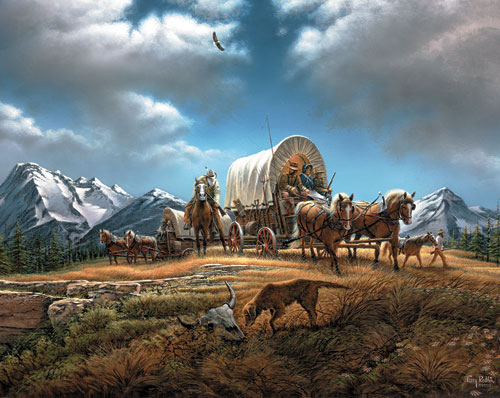
The height and width of the screenshot is (398, 500). Find the location of `painting`. painting is located at coordinates (180, 153).